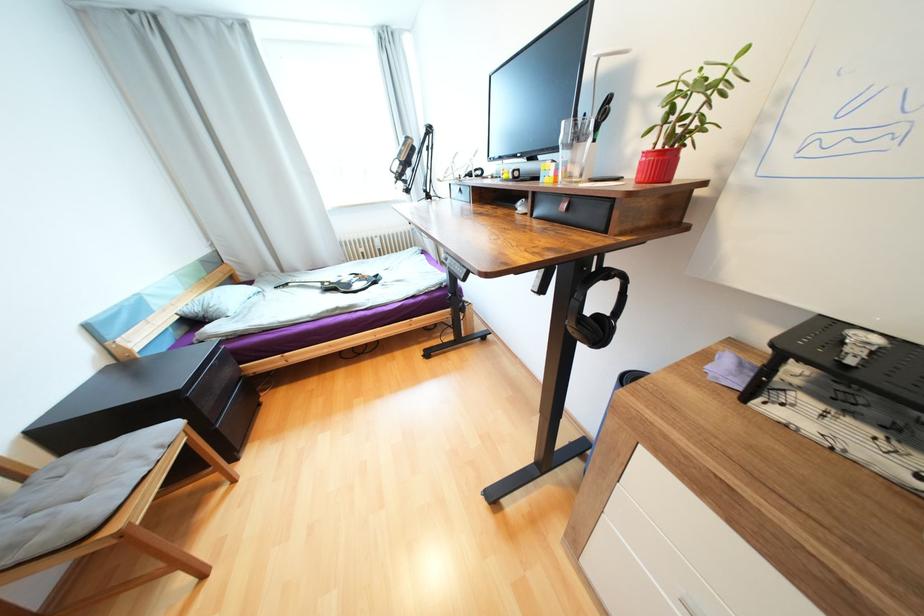
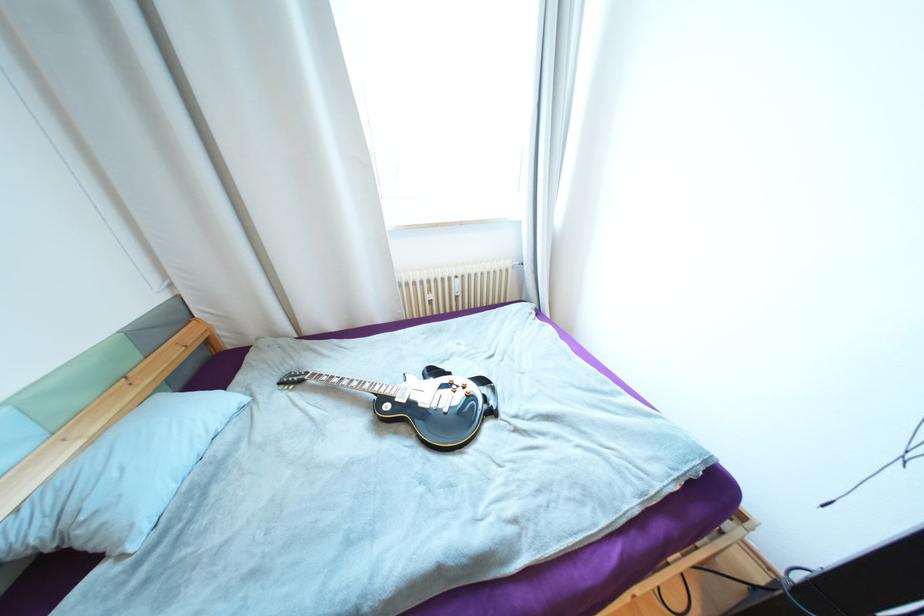
Find the pixel in the second image that matches (381,283) in the first image.

(497, 413)